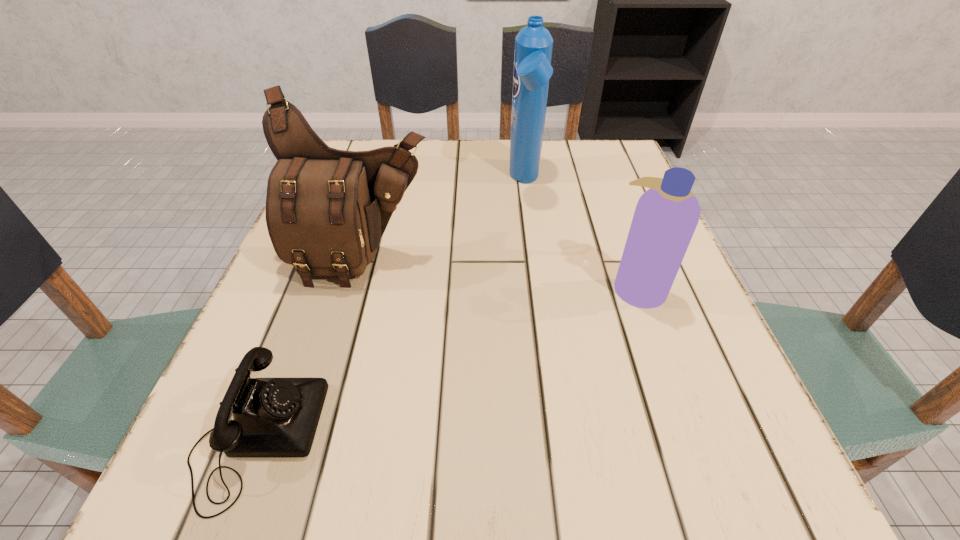
Find the location of a particular element. This screenshot has height=540, width=960. vacant space located 0.400m on the front face of the shortest object is located at coordinates (610, 436).

Locate an element on the screen. This screenshot has width=960, height=540. object situated at the far edge is located at coordinates (533, 44).

You are a GUI agent. You are given a task and a screenshot of the screen. Output one action in this format:
    pyautogui.click(x=<x>, y=<y>)
    Task: Click on the object that is at the near edge
    
    Given the screenshot: What is the action you would take?
    pyautogui.click(x=272, y=417)

The image size is (960, 540). What are the coordinates of `shoulder bag that is positioned at the left edge` in the screenshot? It's located at (326, 209).

This screenshot has height=540, width=960. I want to click on telephone that is at the left edge, so click(x=272, y=417).

The image size is (960, 540). Find the location of `object that is at the right edge`. object that is at the right edge is located at coordinates (666, 216).

Locate an element on the screen. object that is at the near left corner is located at coordinates (272, 417).

Image resolution: width=960 pixels, height=540 pixels. Find the location of `vacant space at the far edge of the desktop`. vacant space at the far edge of the desktop is located at coordinates [x=444, y=140].

Locate an element on the screen. This screenshot has width=960, height=540. free region at the near edge of the desktop is located at coordinates (646, 470).

In the image, there is a desktop. Identify the location of vacant space at the left edge. The height and width of the screenshot is (540, 960). [x=239, y=356].